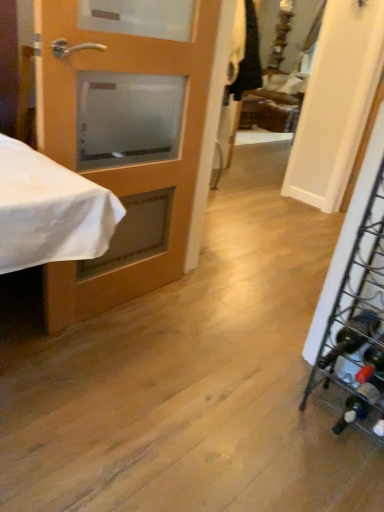
Question: Would you say metallic wire wine rack at right is to the left or to the right of matte wood door at left in the picture?

Choices:
 (A) right
 (B) left

Answer: (A)

Question: Is point (369, 422) positioned closer to the camera than point (142, 177)?

Choices:
 (A) farther
 (B) closer

Answer: (B)

Question: From the image's perspective, relative to matte wood door at left, is metallic wire wine rack at right above or below?

Choices:
 (A) below
 (B) above

Answer: (A)

Question: From the image's perspective, is matte wood door at left located above or below metallic wire wine rack at right?

Choices:
 (A) above
 (B) below

Answer: (A)

Question: Is matte wood door at left inside the boundaries of metallic wire wine rack at right, or outside?

Choices:
 (A) inside
 (B) outside

Answer: (B)

Question: Is point (72, 28) positioned closer to the camera than point (354, 297)?

Choices:
 (A) farther
 (B) closer

Answer: (B)

Question: From their relative heights in the image, would you say matte wood door at left is taller or shorter than metallic wire wine rack at right?

Choices:
 (A) tall
 (B) short

Answer: (A)